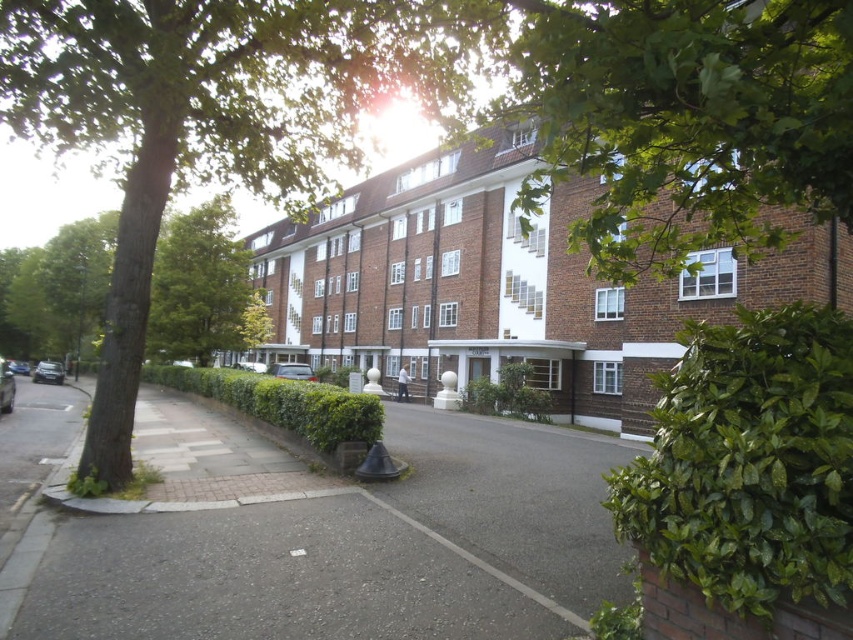
Question: Which point is farther to the camera?

Choices:
 (A) green leafy tree at center
 (B) green leafy tree at upper left
 (C) green leafy hedge at center
 (D) green leafy hedge at lower left

Answer: (C)

Question: Is green leafy tree at upper left to the right of green leafy hedge at center from the viewer's perspective?

Choices:
 (A) yes
 (B) no

Answer: (B)

Question: Is green leafy tree at center thinner than green leafy tree at left?

Choices:
 (A) no
 (B) yes

Answer: (B)

Question: Considering the relative positions of green leafy tree at upper left and green leafy tree at left in the image provided, where is green leafy tree at upper left located with respect to green leafy tree at left?

Choices:
 (A) above
 (B) below

Answer: (A)

Question: Based on their relative distances, which object is farther from the green leafy tree at left?

Choices:
 (A) green leafy tree at upper left
 (B) brown brick building at center
 (C) green leafy hedge at lower right
 (D) green leafy hedge at center

Answer: (C)

Question: Based on their relative distances, which object is nearer to the green leafy tree at upper left?

Choices:
 (A) green leafy hedge at lower right
 (B) green leafy tree at left

Answer: (A)